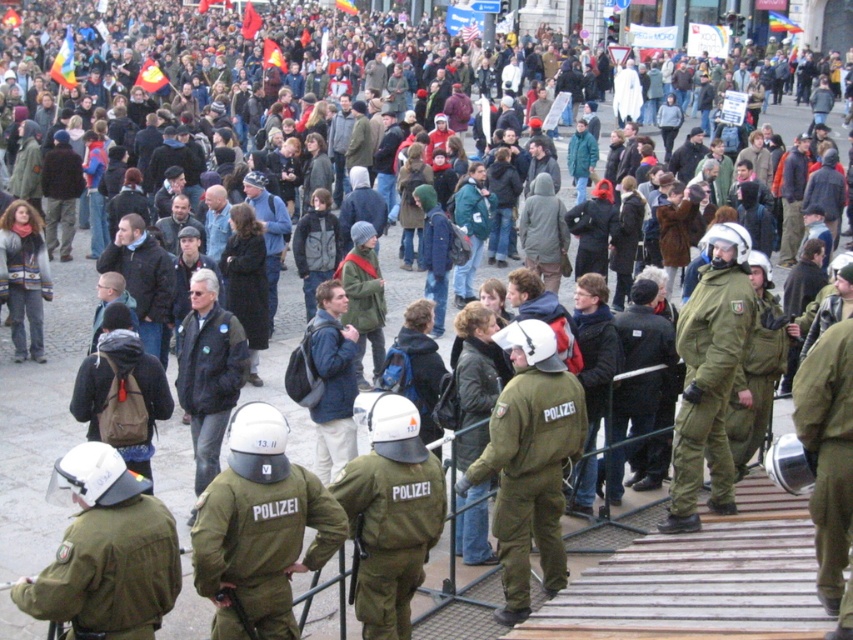
Question: Does green uniformed officer at center appear under dark blue jacket at center?

Choices:
 (A) yes
 (B) no

Answer: (A)

Question: Does green uniformed officer at center appear on the right side of blue fabric backpack at center?

Choices:
 (A) no
 (B) yes

Answer: (B)

Question: Can you confirm if green uniformed officer at center is thinner than dark blue leather jacket at center?

Choices:
 (A) no
 (B) yes

Answer: (B)

Question: Estimate the real-world distances between objects in this image. Which object is closer to the blue fabric backpack at center?

Choices:
 (A) green uniformed officer at center
 (B) dark blue jacket at center
 (C) dark blue leather jacket at center

Answer: (C)

Question: Estimate the real-world distances between objects in this image. Which object is farther from the dark blue jacket at center?

Choices:
 (A) blue fabric backpack at center
 (B) green uniformed officer at center

Answer: (B)

Question: Estimate the real-world distances between objects in this image. Which object is closer to the blue fabric backpack at center?

Choices:
 (A) dark blue leather jacket at center
 (B) green uniformed officer at center
 (C) dark blue jacket at center

Answer: (A)